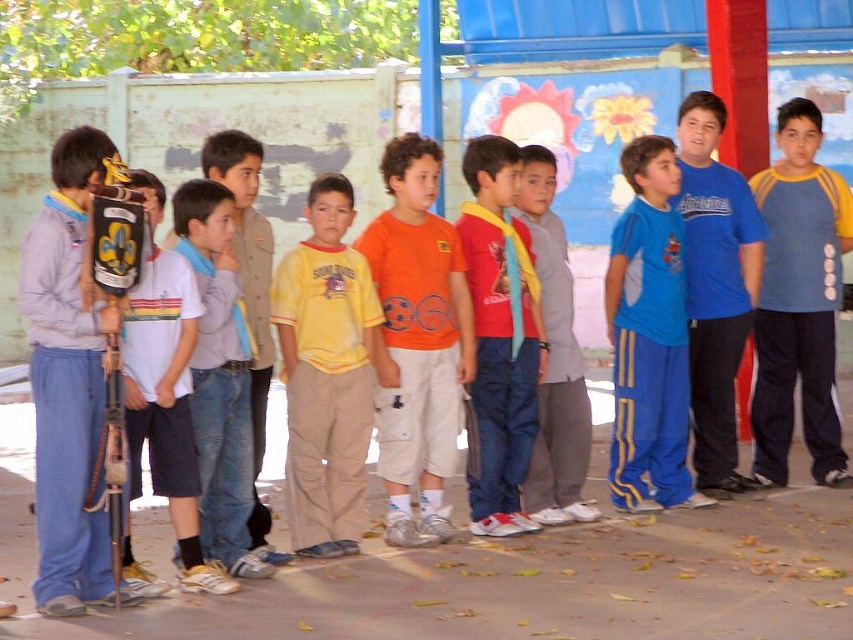
Question: Among these objects, which one is farthest from the camera?

Choices:
 (A) blue/gray track suit at center
 (B) orange cotton t-shirt at center
 (C) red matte shirt at center
 (D) blue jersey at center

Answer: (A)

Question: In this image, where is orange cotton t-shirt at center located relative to blue/gray track suit at center?

Choices:
 (A) above
 (B) below

Answer: (B)

Question: Is blue/gray track suit at center wider than red matte shirt at center?

Choices:
 (A) yes
 (B) no

Answer: (A)

Question: Observing the image, what is the correct spatial positioning of blue/gray track suit at center in reference to white cotton shirt at center?

Choices:
 (A) below
 (B) above

Answer: (B)

Question: Which point is closer to the camera?

Choices:
 (A) yellow cotton shirt at center
 (B) blue jersey at center
 (C) gray cotton pants at center
 (D) blue/gray track suit at center

Answer: (A)

Question: Which point is farther to the camera?

Choices:
 (A) orange cotton t-shirt at center
 (B) blue jersey at center
 (C) white matte shirt at left
 (D) yellow cotton shirt at center

Answer: (B)